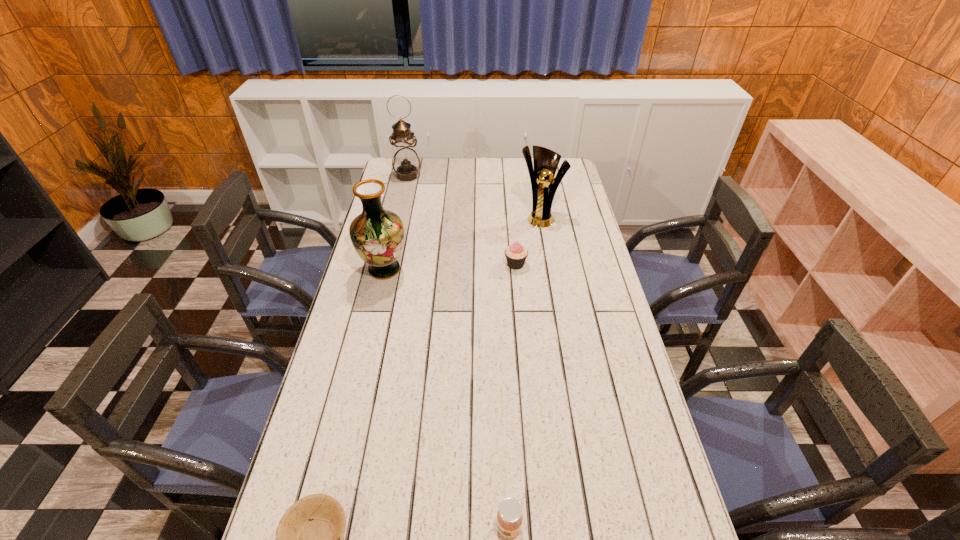
Find the location of a particular element. Image resolution: width=960 pixels, height=540 pixels. vase that is at the left edge is located at coordinates (377, 235).

You are a GUI agent. You are given a task and a screenshot of the screen. Output one action in this format:
    pyautogui.click(x=<x>, y=<y>)
    Task: Click on the object situated at the right edge
    Image resolution: width=960 pixels, height=540 pixels.
    Given the screenshot: What is the action you would take?
    pyautogui.click(x=544, y=186)

Identify the location of object situated at the far left corner. The height and width of the screenshot is (540, 960). (406, 163).

The width and height of the screenshot is (960, 540). In the image, there is a desktop. What are the coordinates of `free region at the left edge` in the screenshot? It's located at (411, 198).

Find the location of a particular element. free point at the right edge is located at coordinates (568, 278).

Where is `vacant space at the far left corner of the desktop`? vacant space at the far left corner of the desktop is located at coordinates (391, 176).

Where is `blank region between the cupcake and the second farthest object`? This screenshot has width=960, height=540. blank region between the cupcake and the second farthest object is located at coordinates (528, 240).

You are a GUI agent. You are given a task and a screenshot of the screen. Output one action in this format:
    pyautogui.click(x=<x>, y=<y>)
    Task: Click on the empty location between the second farthest object and the farthest object
    
    Given the screenshot: What is the action you would take?
    pyautogui.click(x=473, y=197)

Find the location of a particular element. Image resolution: width=960 pixels, height=540 pixels. object that is the fourth closest to the second farthest object is located at coordinates (509, 516).

Where is `the closest object relative to the vase`? The image size is (960, 540). the closest object relative to the vase is located at coordinates (516, 254).